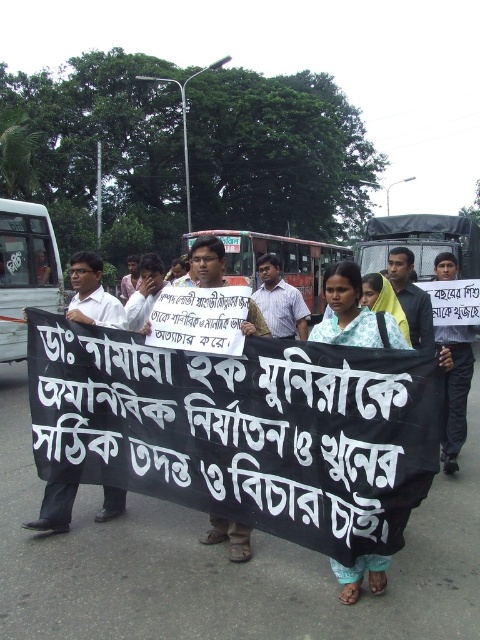
You are a photographer trying to capture the protest group. You notice two points marked in the image. Which point is closer to the photographer? The points are point (x=467, y=371) and point (x=305, y=310).

Point (x=467, y=371) is in front of point (x=305, y=310), so it is closer to the photographer.